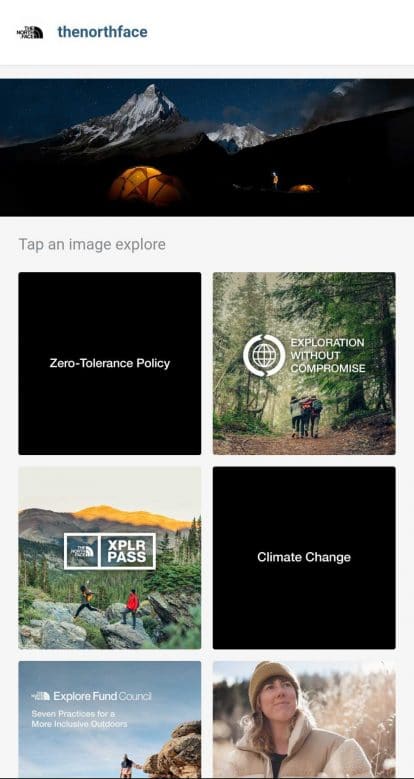
This screenshot has height=779, width=414. Identify the location of rectangular shaped photograph. (217, 104).